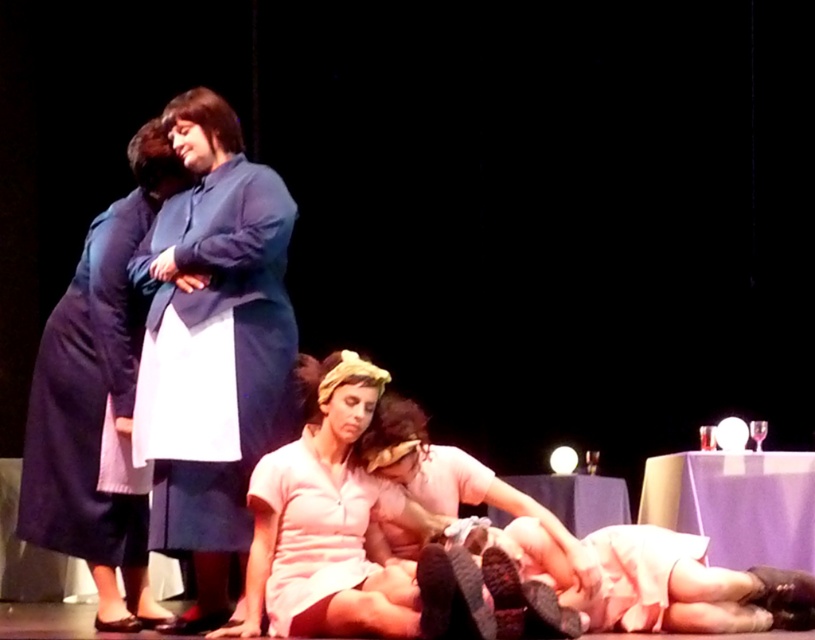
Consider the image. You are a stagehand responsible for placing a 1.5 meter wide curtain between the pink satin dress at lower center and the nearest actor. Is there enough space to place the curtain without overlapping either the dress or the actor?

The pink satin dress at lower center and the nearest actor are 3.37 meters apart. Since the curtain is 1.5 meters wide, there is sufficient space to place it between them without overlapping either object.

You are a stage director observing the actors on the stage. You notice the pink satin dress at lower center and the matte blue dress at upper left. Which actor is positioned to the right of the other?

The pink satin dress at lower center is positioned on the right side of matte blue dress at upper left.

You are an audience member sitting in the front row of the theater. You notice two characters on stage wearing the pink satin dress at lower center and the matte blue dress at upper left. Which character is shorter in height?

The pink satin dress at lower center is not as tall as the matte blue dress at upper left, so the character wearing the pink satin dress at lower center is shorter in height.